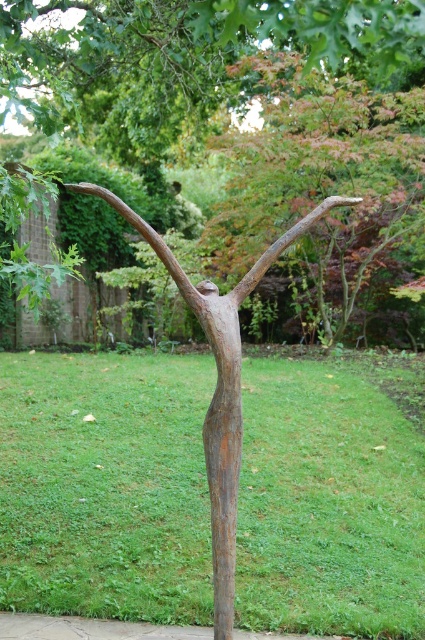
Who is more distant from viewer, (283, 20) or (206, 476)?

The point (206, 476) is more distant.

Who is more forward, (240, 32) or (218, 388)?

Positioned in front is point (218, 388).

The height and width of the screenshot is (640, 425). I want to click on rusty metal tree at center, so click(183, 52).

The image size is (425, 640). Find the location of `rusty metal tree at center`. rusty metal tree at center is located at coordinates (183, 52).